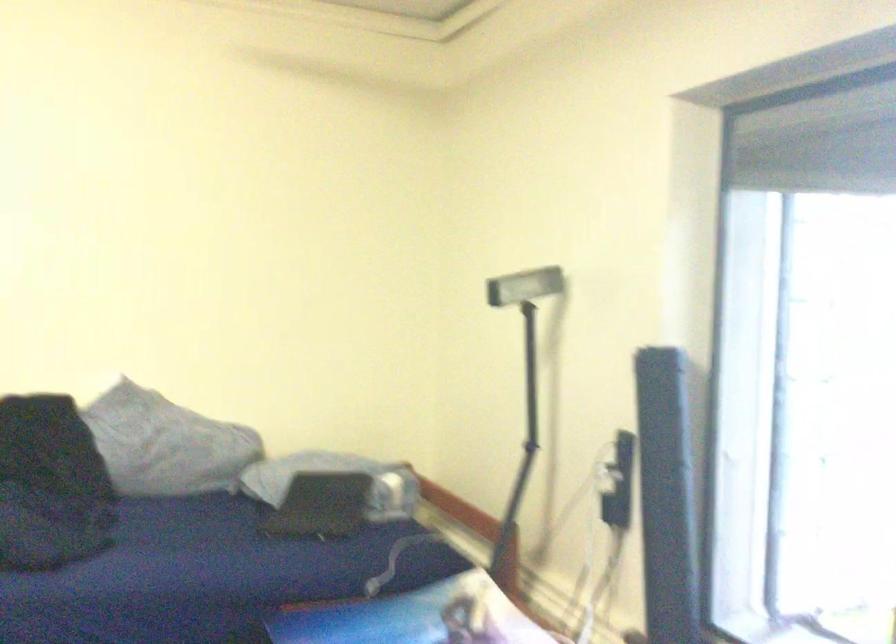
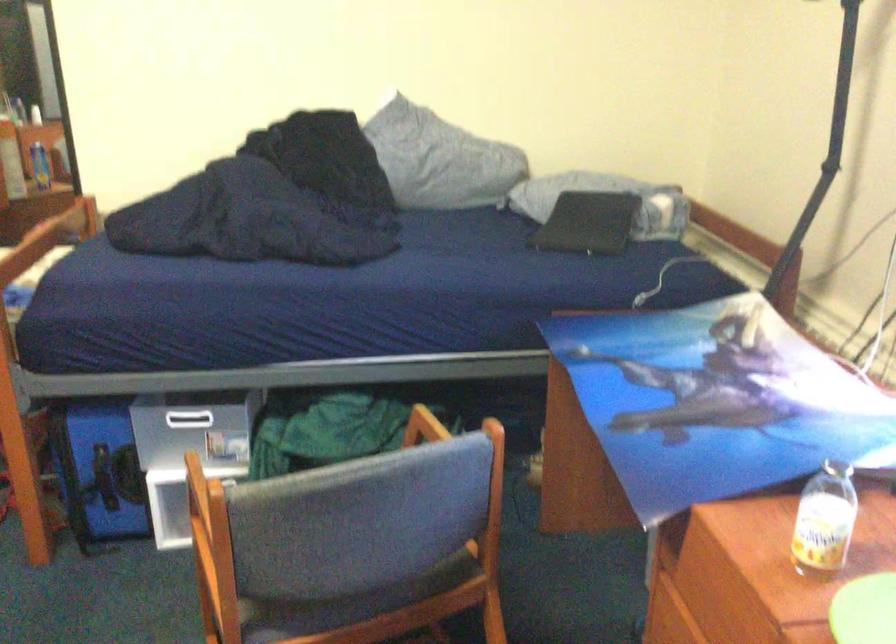
The images are taken continuously from a first-person perspective. In which direction are you moving?

The movement direction of the cameraman is right, forward.